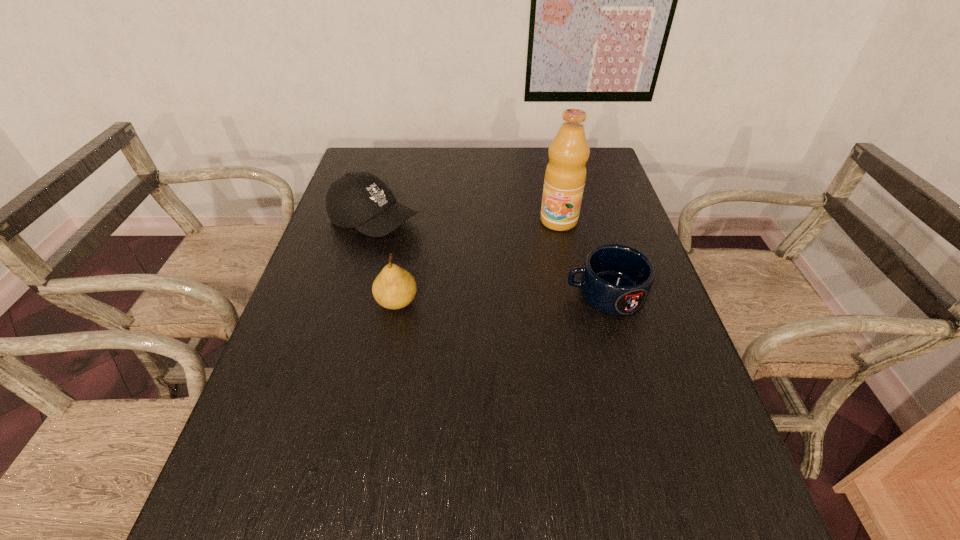
This screenshot has height=540, width=960. I want to click on vacant region at the near left corner, so click(x=239, y=460).

Find the location of a particular element. This screenshot has height=540, width=960. free space between the pear and the shortest object is located at coordinates (501, 298).

At what (x,y) coordinates should I click in order to perform the action: click on free space between the baseball cap and the tallest object. Please return your answer as a coordinate pair (x, y). The width and height of the screenshot is (960, 540). Looking at the image, I should click on (467, 221).

I want to click on vacant space in between the pear and the tallest object, so pos(478,261).

Locate an element on the screen. The height and width of the screenshot is (540, 960). free space between the tallest object and the baseball cap is located at coordinates (467, 221).

The height and width of the screenshot is (540, 960). I want to click on vacant space that is in between the tallest object and the baseball cap, so click(467, 221).

I want to click on vacant space that's between the pear and the baseball cap, so click(386, 262).

The height and width of the screenshot is (540, 960). I want to click on vacant region between the baseball cap and the shortest object, so click(490, 258).

Find the location of a particular element. The width and height of the screenshot is (960, 540). free space between the pear and the baseball cap is located at coordinates (386, 262).

Where is `free area in between the pear and the tallest object`? The height and width of the screenshot is (540, 960). free area in between the pear and the tallest object is located at coordinates (478, 261).